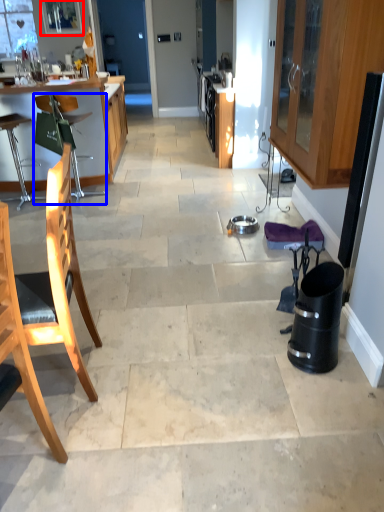
Question: Among these objects, which one is nearest to the camera, window screen (highlighted by a red box) or chair (highlighted by a blue box)?

Choices:
 (A) window screen
 (B) chair

Answer: (B)